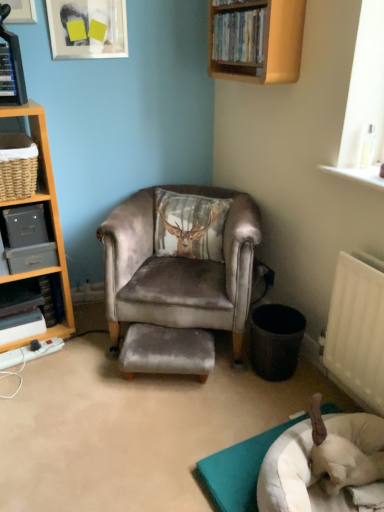
Identify the location of vacant area on the back side of white fabric dog bed at lower right. The width and height of the screenshot is (384, 512). (263, 395).